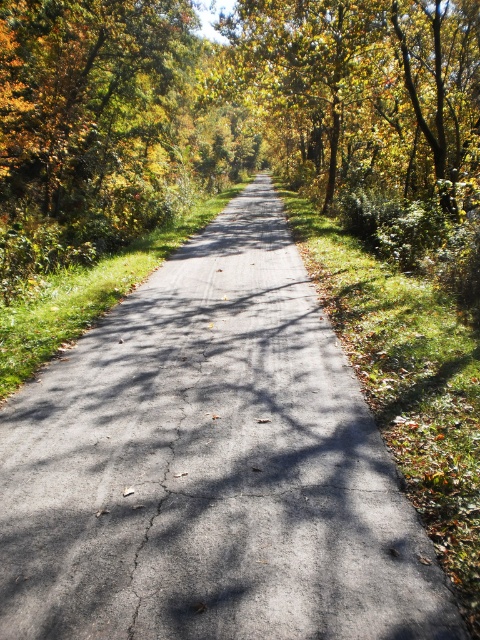
You are a photographer planning to capture the golden foliage at center and golden yellow leaves at upper center in a single frame. Based on their sizes, which one should you focus on to ensure both are visible without cropping?

The golden foliage at center is wider than golden yellow leaves at upper center, so focusing on the golden foliage at center would ensure both are visible without cropping.